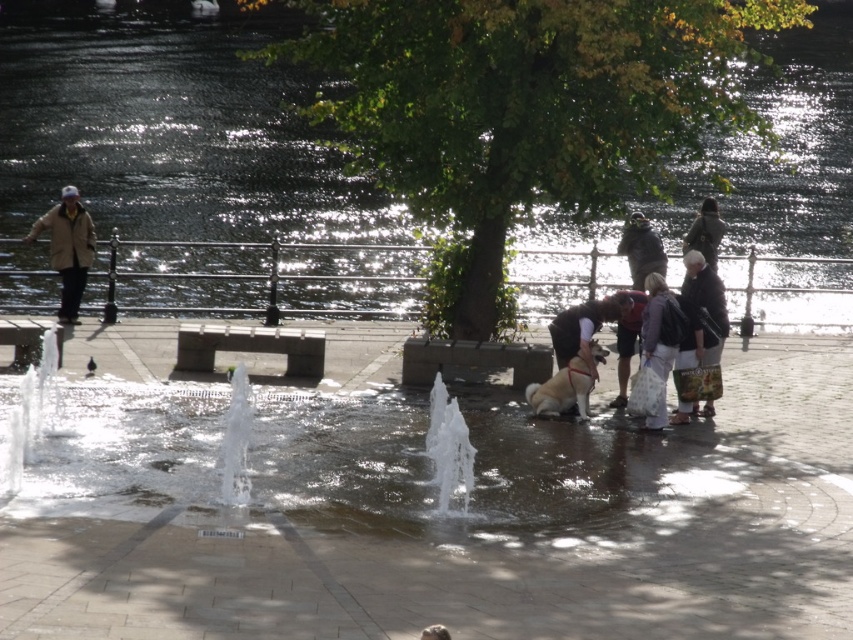
Is dark blue jeans at center closer to the viewer compared to green textured coat at upper right?

Yes, dark blue jeans at center is closer to the viewer.

Who is more distant from viewer, (639,321) or (724,230)?

Point (724,230)

This screenshot has width=853, height=640. Describe the element at coordinates (625, 337) in the screenshot. I see `dark blue jeans at center` at that location.

This screenshot has width=853, height=640. I want to click on dark blue jeans at center, so click(x=625, y=337).

Is clear water fountain at center wider than fuzzy beige dog at center?

Yes.

Does clear water fountain at center have a lesser width compared to fuzzy beige dog at center?

Incorrect, clear water fountain at center's width is not less than fuzzy beige dog at center's.

Locate an element on the screen. The height and width of the screenshot is (640, 853). clear water fountain at center is located at coordinates (431, 515).

Does beige wool coat at left have a larger size compared to dark gray jacket at upper right?

Correct, beige wool coat at left is larger in size than dark gray jacket at upper right.

Who is positioned more to the right, beige wool coat at left or dark gray jacket at upper right?

Positioned to the right is dark gray jacket at upper right.

Who is more forward, (x=64, y=301) or (x=618, y=246)?

Point (x=64, y=301) is in front.

At what (x,y) coordinates should I click in order to perform the action: click on beige wool coat at left. Please return your answer as a coordinate pair (x, y). Image resolution: width=853 pixels, height=640 pixels. Looking at the image, I should click on (68, 248).